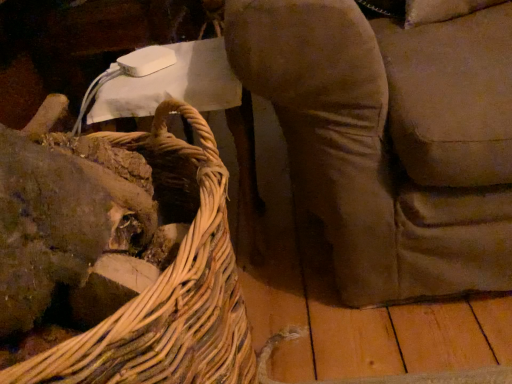
Question: Is woven wood picnic basket at left to the right of velvet brown armchair at center from the viewer's perspective?

Choices:
 (A) yes
 (B) no

Answer: (B)

Question: Is woven wood picnic basket at left facing away from velvet brown armchair at center?

Choices:
 (A) yes
 (B) no

Answer: (B)

Question: From the image's perspective, is woven wood picnic basket at left below velvet brown armchair at center?

Choices:
 (A) no
 (B) yes

Answer: (B)

Question: Is velvet brown armchair at center inside woven wood picnic basket at left?

Choices:
 (A) no
 (B) yes

Answer: (A)

Question: Does woven wood picnic basket at left have a larger size compared to velvet brown armchair at center?

Choices:
 (A) yes
 (B) no

Answer: (B)

Question: Is woven wood picnic basket at left not near velvet brown armchair at center?

Choices:
 (A) yes
 (B) no

Answer: (B)

Question: Is velvet brown armchair at center not near woven wood picnic basket at left?

Choices:
 (A) no
 (B) yes

Answer: (A)

Question: Considering the relative sizes of velvet brown armchair at center and woven wood picnic basket at left in the image provided, is velvet brown armchair at center smaller than woven wood picnic basket at left?

Choices:
 (A) no
 (B) yes

Answer: (A)

Question: From the image's perspective, would you say velvet brown armchair at center is shown under woven wood picnic basket at left?

Choices:
 (A) yes
 (B) no

Answer: (B)

Question: Is velvet brown armchair at center outside woven wood picnic basket at left?

Choices:
 (A) no
 (B) yes

Answer: (B)

Question: Considering the relative positions of velvet brown armchair at center and woven wood picnic basket at left in the image provided, is velvet brown armchair at center behind woven wood picnic basket at left?

Choices:
 (A) no
 (B) yes

Answer: (B)

Question: From a real-world perspective, is velvet brown armchair at center on top of woven wood picnic basket at left?

Choices:
 (A) yes
 (B) no

Answer: (A)

Question: Is woven wood picnic basket at left to the left or to the right of velvet brown armchair at center in the image?

Choices:
 (A) left
 (B) right

Answer: (A)